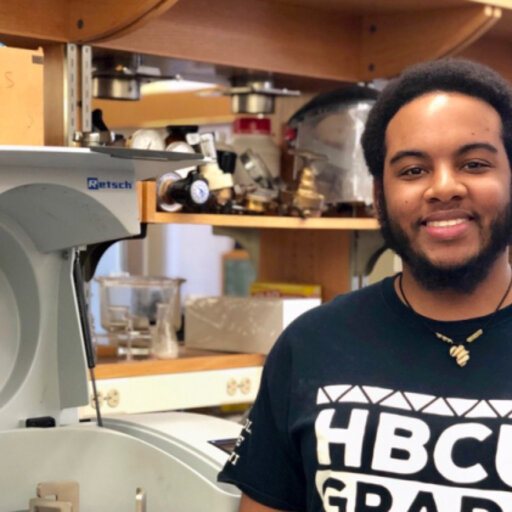
The width and height of the screenshot is (512, 512). Identify the location of plug outlet. (98, 400), (111, 399), (233, 390), (246, 385).